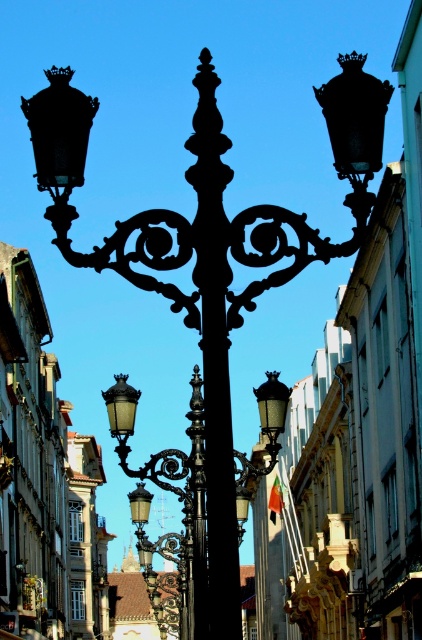
Question: Is black wrought iron pole at center to the left of matte black street light at center from the viewer's perspective?

Choices:
 (A) no
 (B) yes

Answer: (A)

Question: Does black wrought iron pole at center have a greater width compared to matte black street light at center?

Choices:
 (A) yes
 (B) no

Answer: (B)

Question: From the image, what is the correct spatial relationship of black wrought iron pole at center in relation to matte black street light at center?

Choices:
 (A) above
 (B) below

Answer: (A)

Question: Which of the following is the farthest from the observer?

Choices:
 (A) (187, 584)
 (B) (213, 458)

Answer: (A)